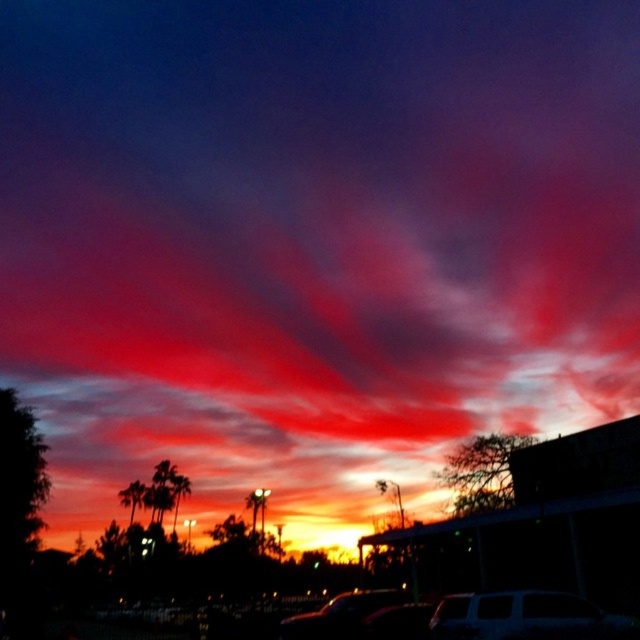
Can you confirm if matte white van at lower center is positioned to the right of shiny black car at center?

Yes, matte white van at lower center is to the right of shiny black car at center.

What do you see at coordinates (513, 614) in the screenshot? This screenshot has width=640, height=640. I see `matte white van at lower center` at bounding box center [513, 614].

At what (x,y) coordinates should I click in order to perform the action: click on matte white van at lower center. Please return your answer as a coordinate pair (x, y). The width and height of the screenshot is (640, 640). Looking at the image, I should click on (513, 614).

Locate an element on the screen. This screenshot has height=640, width=640. matte white van at lower center is located at coordinates (513, 614).